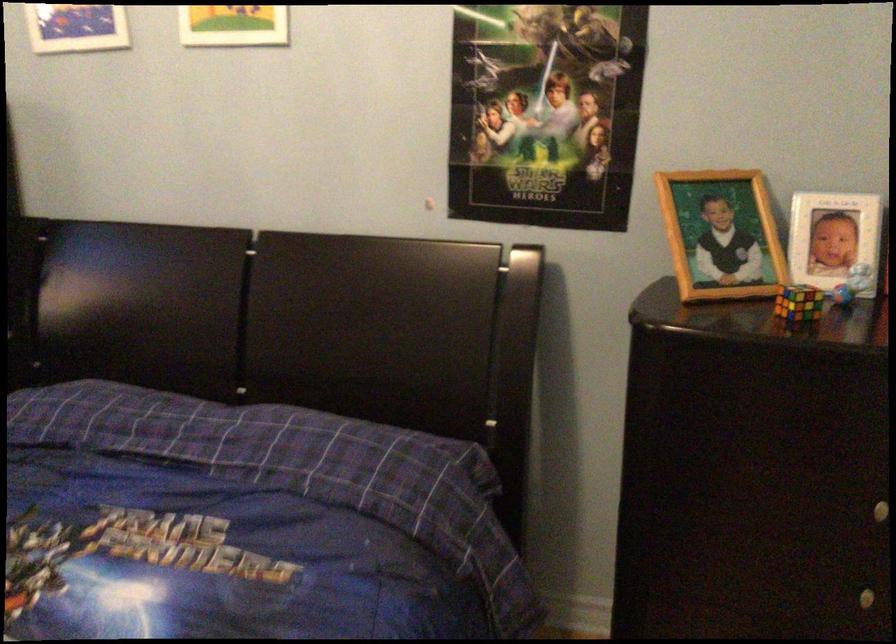
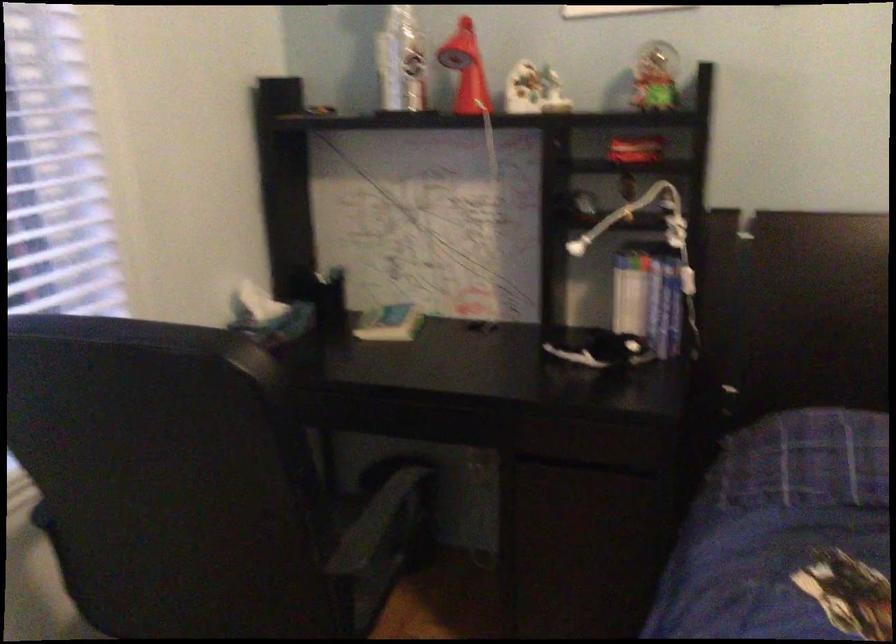
Question: Which direction would the cameraman need to move to produce the second image? Reply with the corresponding letter.

Choices:
 (A) Left
 (B) Right
 (C) Forward
 (D) Backward

Answer: (A)